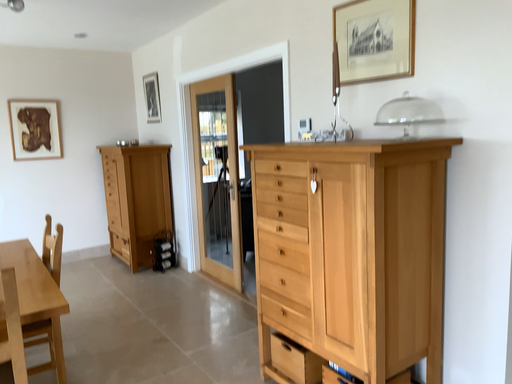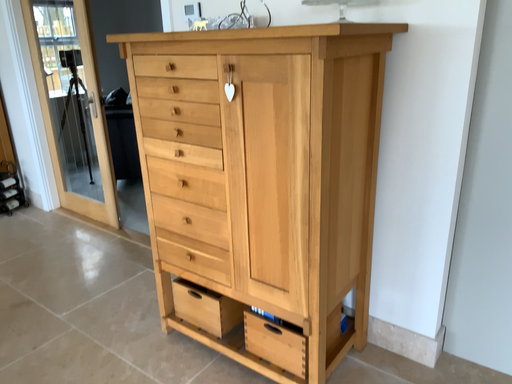
Question: How did the camera likely rotate when shooting the video?

Choices:
 (A) rotated upward
 (B) rotated downward

Answer: (B)